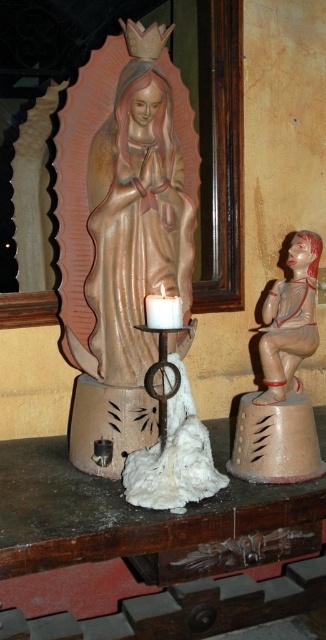
From the picture: You are a visitor at a religious site and want to light a candle at the wooden table at center. The candle holder with the lit white candle is 32.64 inches away from you. Can you reach it without moving your feet?

The candle holder with the lit white candle is 32.64 inches away from you, so yes, you can reach it without moving your feet as the average human arm length is about 25 to 35 inches.

You are a visitor at a religious site and want to light a candle in front of the statue of the Virgin Mary. You have a white matte candle holder at center. Can you place it on the wooden table at center without it being too unstable?

The wooden table at center is much taller than the white matte candle holder at center, so placing the candle holder on the table would likely be stable as the table provides a solid base. However, ensure the candle is securely placed to prevent tipping.

You are an interior designer planning to install a new lighting fixture. You see the wooden table at center and the matte gold statue at center. Which object is located below the other?

The wooden table at center is positioned under the matte gold statue at center, so the table is below the statue.